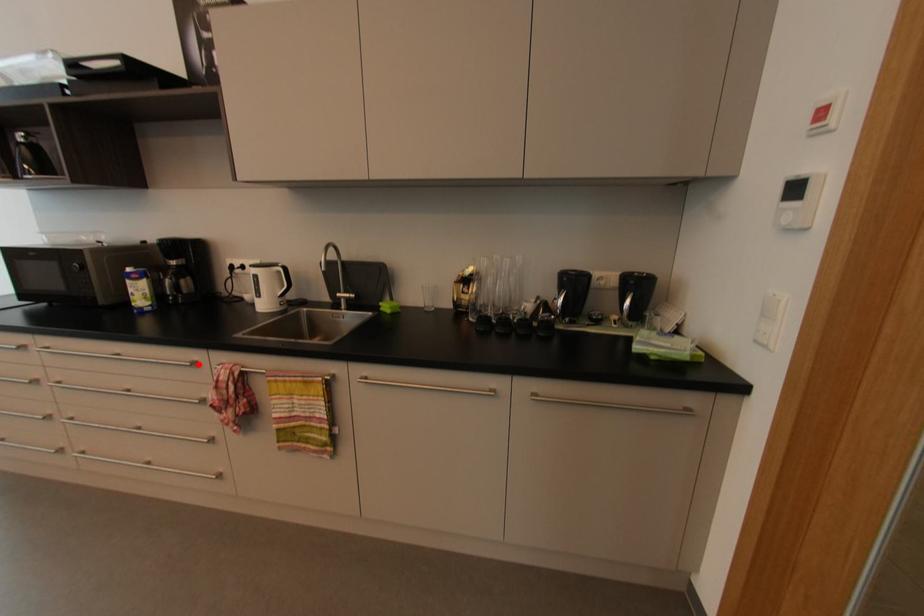
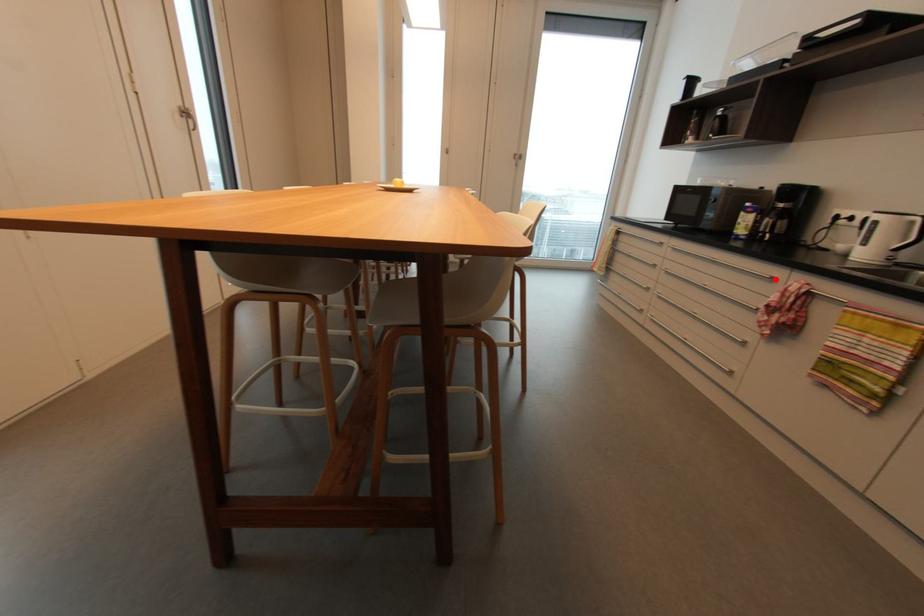
I am providing you with two images of the same scene from different viewpoints. A red point is marked on the first image and another point is marked on the second image. Do the highlighted points in image1 and image2 indicate the same real-world spot?

Yes